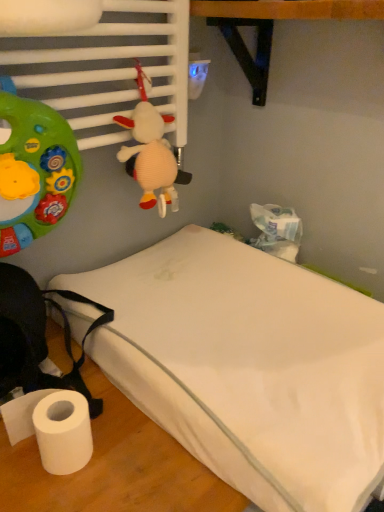
Find the location of a particular element. This screenshot has height=512, width=384. white fabric bed at lower left is located at coordinates (248, 366).

What do you see at coordinates (248, 366) in the screenshot? The height and width of the screenshot is (512, 384). I see `white fabric bed at lower left` at bounding box center [248, 366].

This screenshot has height=512, width=384. Describe the element at coordinates (151, 152) in the screenshot. I see `plush beige at upper center` at that location.

Identify the location of plush beige at upper center. This screenshot has width=384, height=512. (151, 152).

You are a GUI agent. You are given a task and a screenshot of the screen. Output one action in this format:
    pyautogui.click(x=<x>, y=<y>)
    Task: Click on the white fabric bed at lower left
    The height and width of the screenshot is (512, 384).
    Given the screenshot: What is the action you would take?
    pyautogui.click(x=248, y=366)

Is plush beige at upper center to the right of white fabric bed at lower left from the viewer's perspective?

No, plush beige at upper center is not to the right of white fabric bed at lower left.

Which is behind, plush beige at upper center or white fabric bed at lower left?

plush beige at upper center is behind.

Considering the positions of points (156, 117) and (357, 316), is point (156, 117) farther from camera compared to point (357, 316)?

No, (156, 117) is closer to viewer.

From the image's perspective, would you say plush beige at upper center is positioned over white fabric bed at lower left?

Indeed, from the image's perspective, plush beige at upper center is shown above white fabric bed at lower left.

From a real-world perspective, is plush beige at upper center located higher than white fabric bed at lower left?

Correct, in the physical world, plush beige at upper center is higher than white fabric bed at lower left.

From the picture: Is plush beige at upper center wider than white fabric bed at lower left?

Incorrect, the width of plush beige at upper center does not surpass that of white fabric bed at lower left.

Is plush beige at upper center taller or shorter than white fabric bed at lower left?

Clearly, plush beige at upper center is taller compared to white fabric bed at lower left.

Does plush beige at upper center have a smaller size compared to white fabric bed at lower left?

Yes, plush beige at upper center is smaller than white fabric bed at lower left.

From the picture: Is plush beige at upper center surrounding white fabric bed at lower left?

Definitely not — white fabric bed at lower left is not inside plush beige at upper center.

Would you consider plush beige at upper center to be distant from white fabric bed at lower left?

plush beige at upper center is near white fabric bed at lower left, not far away.

Could you tell me if plush beige at upper center is facing white fabric bed at lower left?

No, plush beige at upper center is not facing towards white fabric bed at lower left.

How different are the orientations of plush beige at upper center and white fabric bed at lower left in degrees?

1.27 degrees.

The width and height of the screenshot is (384, 512). Find the location of `bed that appears on the right of plush beige at upper center`. bed that appears on the right of plush beige at upper center is located at coordinates (248, 366).

Which object is positioned more to the right, white fabric bed at lower left or plush beige at upper center?

Positioned to the right is white fabric bed at lower left.

Is the depth of white fabric bed at lower left greater than that of plush beige at upper center?

That is False.

Which point is more forward, [238,346] or [164,213]?

The point [238,346] is in front.

From the image's perspective, is white fabric bed at lower left above or below plush beige at upper center?

white fabric bed at lower left is situated lower than plush beige at upper center in the image.

From a real-world perspective, is white fabric bed at lower left located higher than plush beige at upper center?

No, from a real-world perspective, white fabric bed at lower left is not above plush beige at upper center.

Is white fabric bed at lower left wider than plush beige at upper center?

Indeed, white fabric bed at lower left has a greater width compared to plush beige at upper center.

Can you confirm if white fabric bed at lower left is taller than plush beige at upper center?

No.

Does white fabric bed at lower left have a larger size compared to plush beige at upper center?

Correct, white fabric bed at lower left is larger in size than plush beige at upper center.

Do you think white fabric bed at lower left is within plush beige at upper center, or outside of it?

white fabric bed at lower left is located beyond the bounds of plush beige at upper center.

Is there a large distance between white fabric bed at lower left and plush beige at upper center?

No, white fabric bed at lower left is not far away from plush beige at upper center.

Is white fabric bed at lower left aimed at plush beige at upper center?

No.

Can you tell me how much white fabric bed at lower left and plush beige at upper center differ in facing direction?

1.27 degrees separate the facing orientations of white fabric bed at lower left and plush beige at upper center.

Locate an element on the screen. Image resolution: width=384 pixels, height=512 pixels. toy that appears above the white fabric bed at lower left (from a real-world perspective) is located at coordinates (151, 152).

At what (x,y) coordinates should I click in order to perform the action: click on bed in front of the plush beige at upper center. Please return your answer as a coordinate pair (x, y). Image resolution: width=384 pixels, height=512 pixels. Looking at the image, I should click on (248, 366).

This screenshot has width=384, height=512. I want to click on bed located underneath the plush beige at upper center (from a real-world perspective), so click(248, 366).